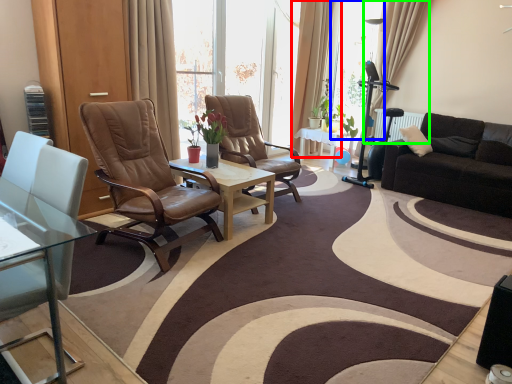
Question: Which object is positioned closest to curtain (highlighted by a red box)? Select from window screen (highlighted by a blue box) and curtain (highlighted by a green box).

Choices:
 (A) window screen
 (B) curtain

Answer: (A)